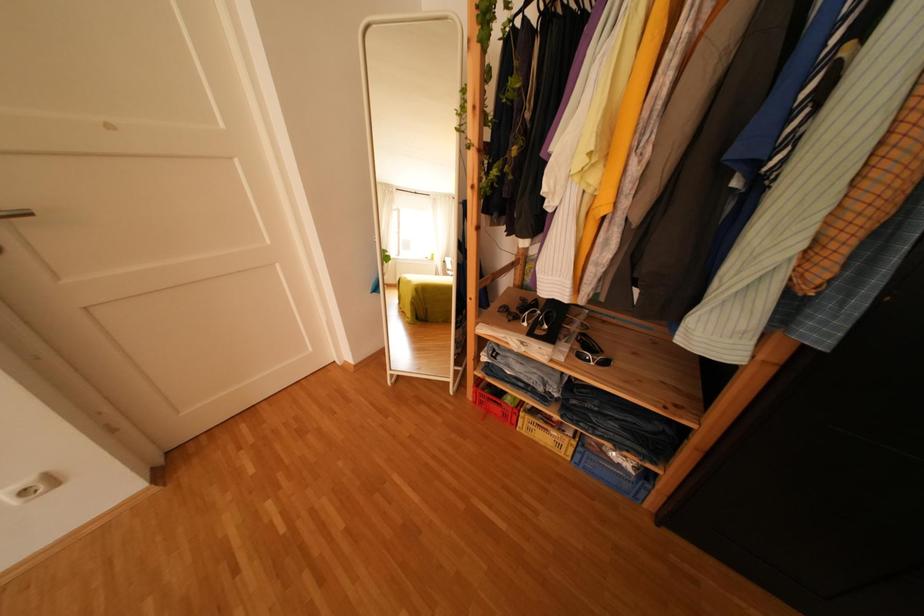
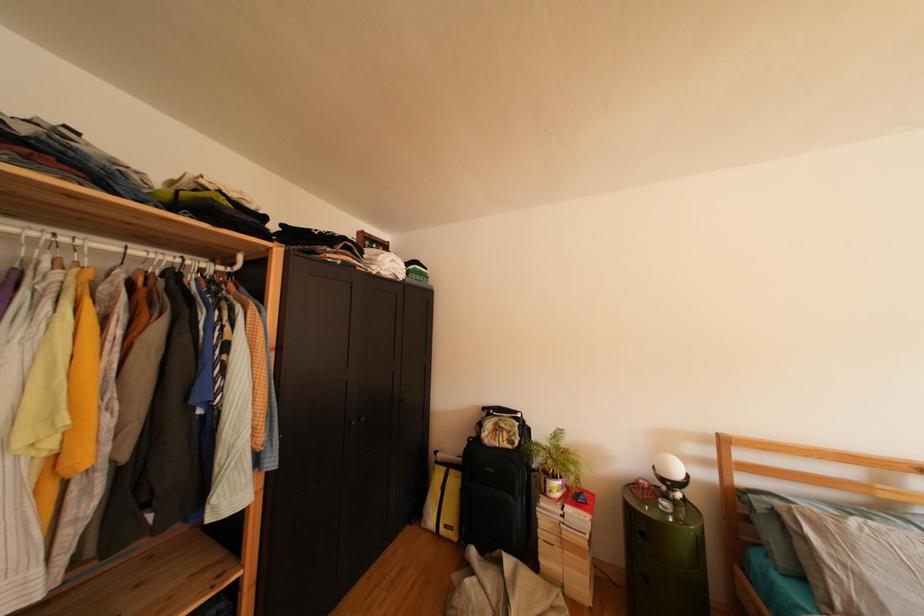
Question: The first image is from the beginning of the video and the second image is from the end. How did the camera likely rotate when shooting the video?

Choices:
 (A) Left
 (B) Right
 (C) Up
 (D) Down

Answer: (B)